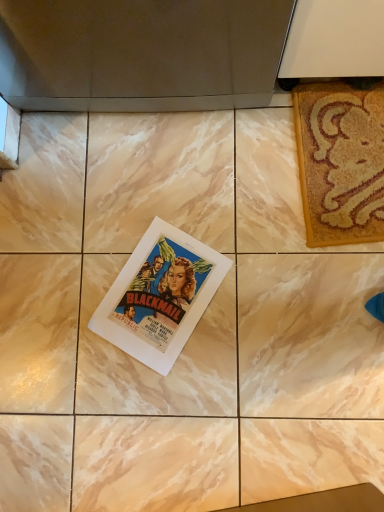
Identify the location of vacant region below white paper at center (from a real-world perspective). Image resolution: width=384 pixels, height=512 pixels. pos(164,291).